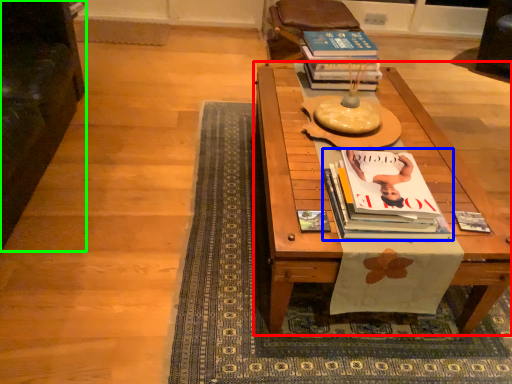
Question: Which object is the farthest from table (highlighted by a red box)? Choose among these: book (highlighted by a blue box) or armchair (highlighted by a green box).

Choices:
 (A) book
 (B) armchair

Answer: (B)